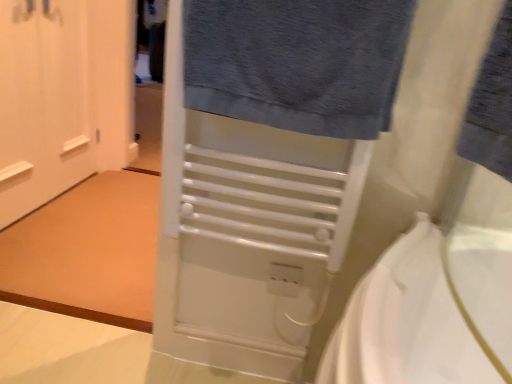
Question: Is the position of white matte door at left more distant than that of white plastic electric outlet at center?

Choices:
 (A) yes
 (B) no

Answer: (A)

Question: Does white matte door at left have a lesser width compared to white plastic electric outlet at center?

Choices:
 (A) no
 (B) yes

Answer: (A)

Question: Is white matte door at left next to white plastic electric outlet at center and touching it?

Choices:
 (A) yes
 (B) no

Answer: (B)

Question: Does white matte door at left lie in front of white plastic electric outlet at center?

Choices:
 (A) no
 (B) yes

Answer: (A)

Question: Would you say white matte door at left is outside white plastic electric outlet at center?

Choices:
 (A) yes
 (B) no

Answer: (A)

Question: From their relative heights in the image, would you say white matte door at left is taller or shorter than white plastic electric outlet at center?

Choices:
 (A) short
 (B) tall

Answer: (B)

Question: Would you say white matte door at left is to the left or to the right of white plastic electric outlet at center in the picture?

Choices:
 (A) left
 (B) right

Answer: (A)

Question: Is white matte door at left situated inside white plastic electric outlet at center or outside?

Choices:
 (A) outside
 (B) inside

Answer: (A)

Question: From the image's perspective, relative to white plastic electric outlet at center, is white matte door at left above or below?

Choices:
 (A) above
 (B) below

Answer: (A)

Question: Is white matte door at left bigger or smaller than blue cotton towel at upper right?

Choices:
 (A) small
 (B) big

Answer: (B)

Question: In terms of width, does white matte door at left look wider or thinner when compared to blue cotton towel at upper right?

Choices:
 (A) wide
 (B) thin

Answer: (B)

Question: Is white matte door at left taller or shorter than blue cotton towel at upper right?

Choices:
 (A) tall
 (B) short

Answer: (A)

Question: Considering the positions of point (66, 152) and point (501, 170), is point (66, 152) closer or farther from the camera than point (501, 170)?

Choices:
 (A) farther
 (B) closer

Answer: (A)

Question: Is point (24, 206) closer or farther from the camera than point (195, 36)?

Choices:
 (A) farther
 (B) closer

Answer: (A)

Question: Visually, is white matte door at left positioned to the left or to the right of dark gray textured towel at upper center?

Choices:
 (A) right
 (B) left

Answer: (B)